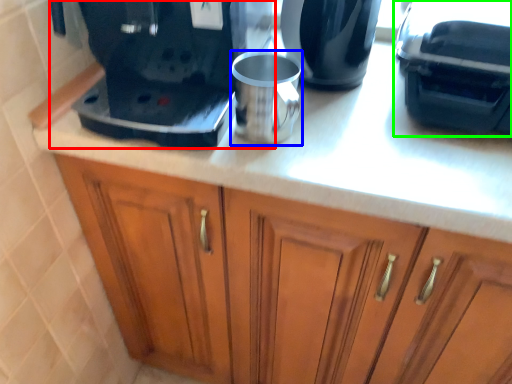
Question: Which object is positioned farthest from home appliance (highlighted by a red box)? Select from mug (highlighted by a blue box) and coffee machine (highlighted by a green box).

Choices:
 (A) mug
 (B) coffee machine

Answer: (B)